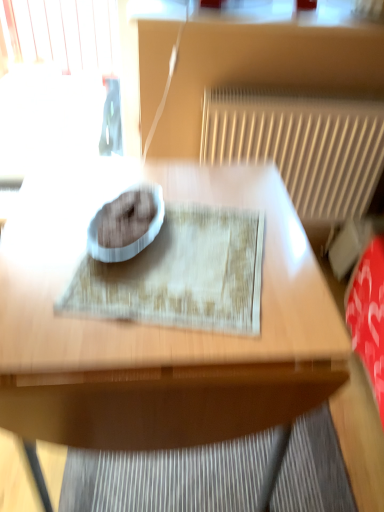
Locate an element on the screen. This screenshot has height=512, width=384. unoccupied space behind textured beige mat at center is located at coordinates (185, 182).